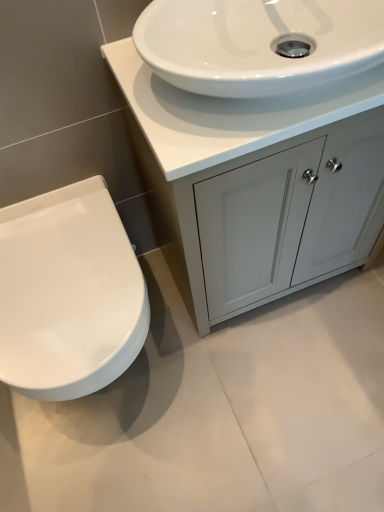
What are the coordinates of `empty space that is to the right of white glossy toilet at left` in the screenshot? It's located at (237, 371).